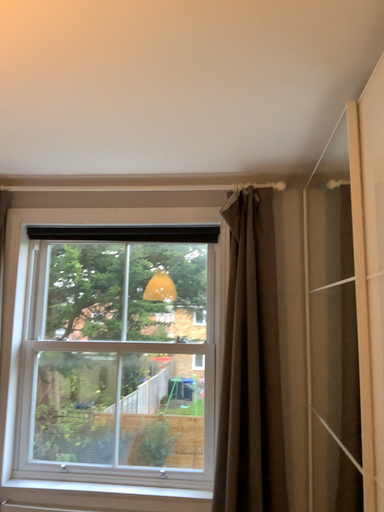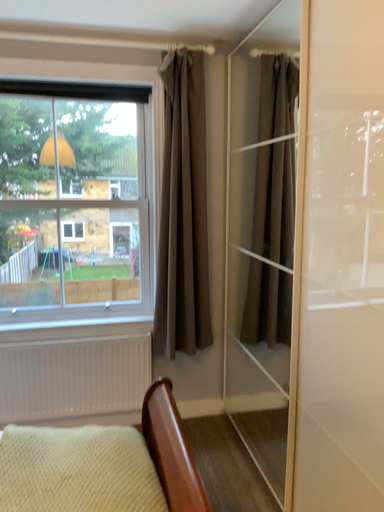
Question: How did the camera likely rotate when shooting the video?

Choices:
 (A) rotated downward
 (B) rotated upward

Answer: (A)